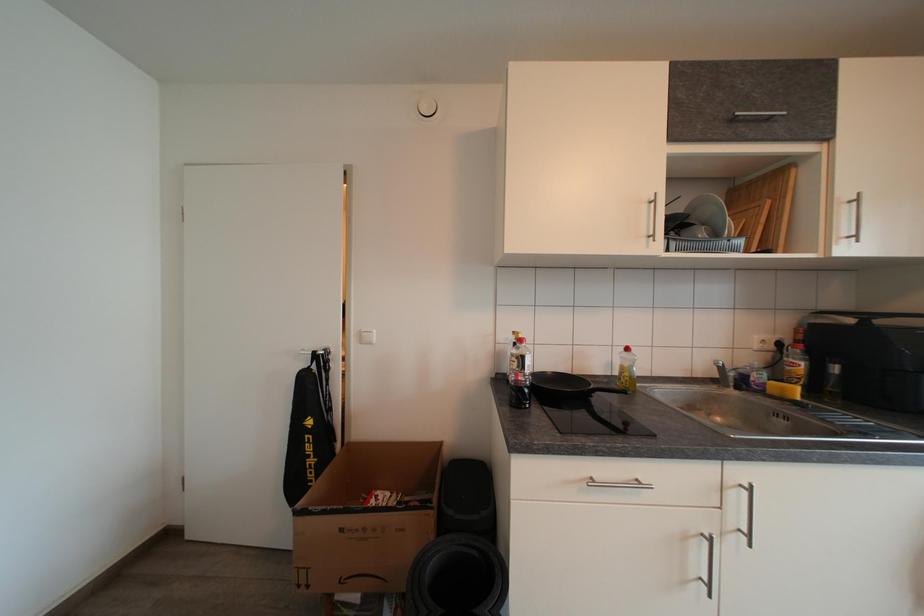
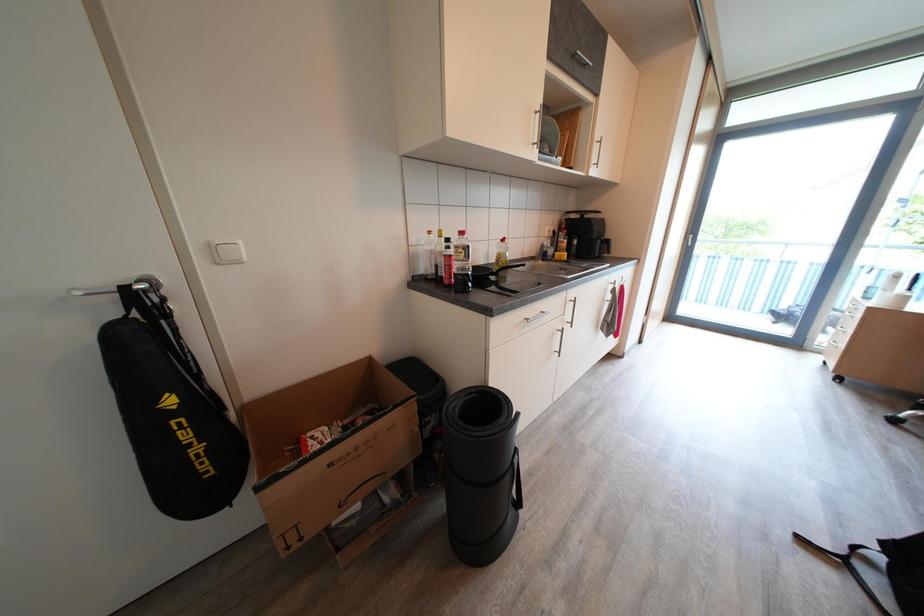
Consider the image. How did the camera likely rotate?

The camera's rotation is toward right-down.